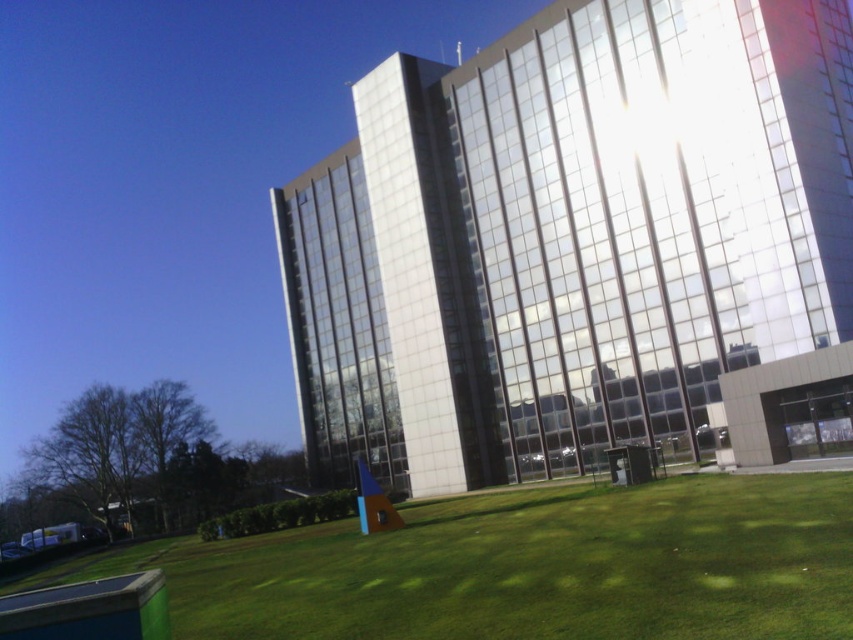
Does glassy reflective building at center have a larger size compared to green grass at lower center?

Indeed, glassy reflective building at center has a larger size compared to green grass at lower center.

Who is shorter, glassy reflective building at center or green grass at lower center?

green grass at lower center is shorter.

Which is behind, point (329, 413) or point (849, 492)?

Positioned behind is point (329, 413).

The height and width of the screenshot is (640, 853). I want to click on glassy reflective building at center, so click(x=567, y=240).